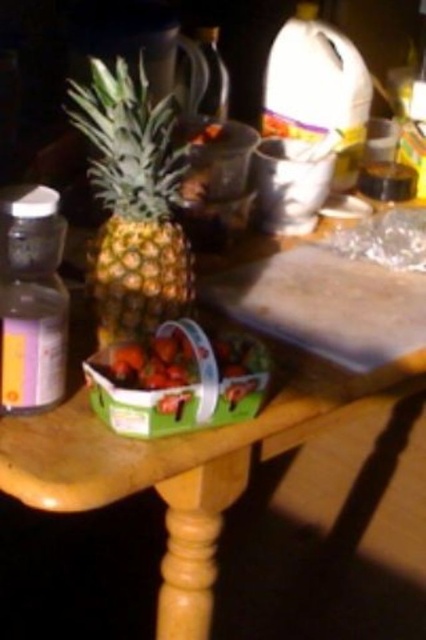
You are taking a photo of the wooden table and notice two points marked on the table. The first point is at coordinates point (273, 420) and the second is at point (167, 285). Which point will appear closer to the camera in the photo?

Point (273, 420) is closer to the camera than point (167, 285), so it will appear closer in the photo.

You are standing in front of a wooden table at center. You want to place a 18 inch long object on the table. Can you fit it on the table without moving any items?

The distance between you and the wooden table at center is 21.01 inches, so yes, you can place an 18 inch long object on the table since it is shorter than the distance between you and the table.